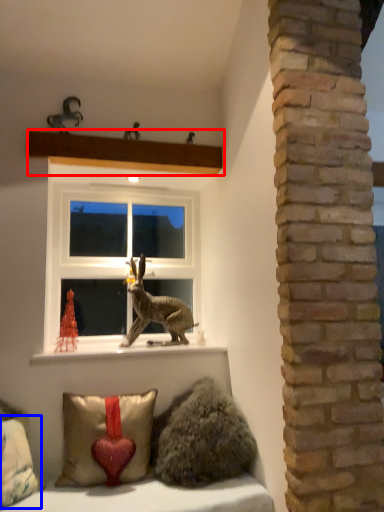
Question: Among these objects, which one is farthest to the camera, shelf (highlighted by a red box) or pillow (highlighted by a blue box)?

Choices:
 (A) shelf
 (B) pillow

Answer: (A)